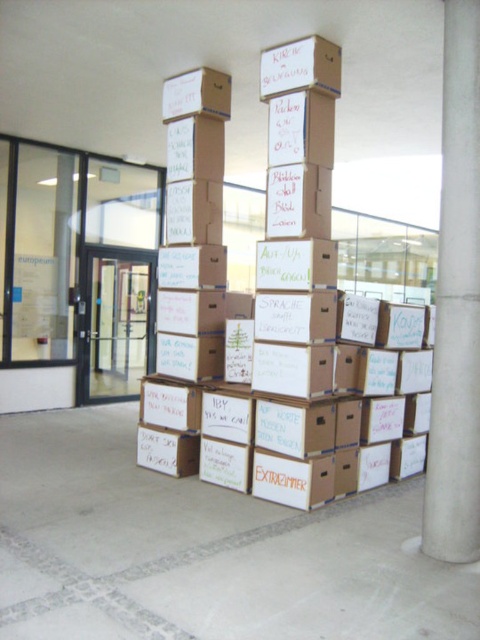
You are organizing boxes in a storage area and need to move the brown cardboard box at center. Which direction should you move it to place it to the left of the matte cardboard box at upper center?

The brown cardboard box at center is currently on the right side of the matte cardboard box at upper center. To place it to the left of the matte cardboard box at upper center, you would need to move it to the left side of the matte cardboard box at upper center.

You are standing in the middle of the room and want to move towards the brown cardboard box at center. Based on its 2D coordinates, in which general direction should you walk? Please choose from the options below. A. North B. South C. East D. West

The 2D coordinates of the brown cardboard box at center are at point (x=277, y=332). Since the coordinate system typically places the origin at the bottom left corner, the x and y values are both above 0.5, meaning it is in the upper right quadrant. However, without knowing the exact orientation of the room or the coordinate system, it is impossible to determine the direction accurately. Therefore, the question cannot be answered with the given information.

Looking at this image, you are moving boxes in a warehouse and need to place the brown cardboard box at center on top of the white concrete pillar at center. Given that the pillar is 1.2 meters in height, can you safely place the box on top without it falling over?

The brown cardboard box at center is larger in size than white concrete pillar at center. Since the box is larger, it may not fit securely on top of the pillar, increasing the risk of it toppling over. It is not advisable to place the box there.